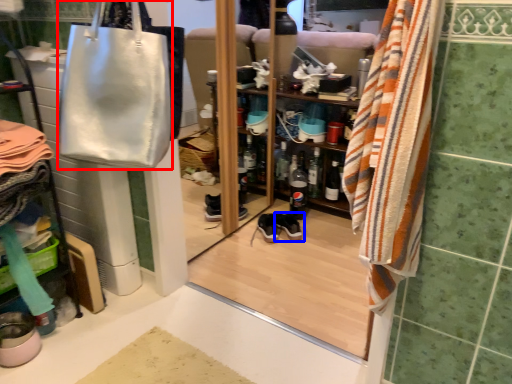
Question: Which of the following is the farthest to the observer, handbag (highlighted by a red box) or footwear (highlighted by a blue box)?

Choices:
 (A) handbag
 (B) footwear

Answer: (B)